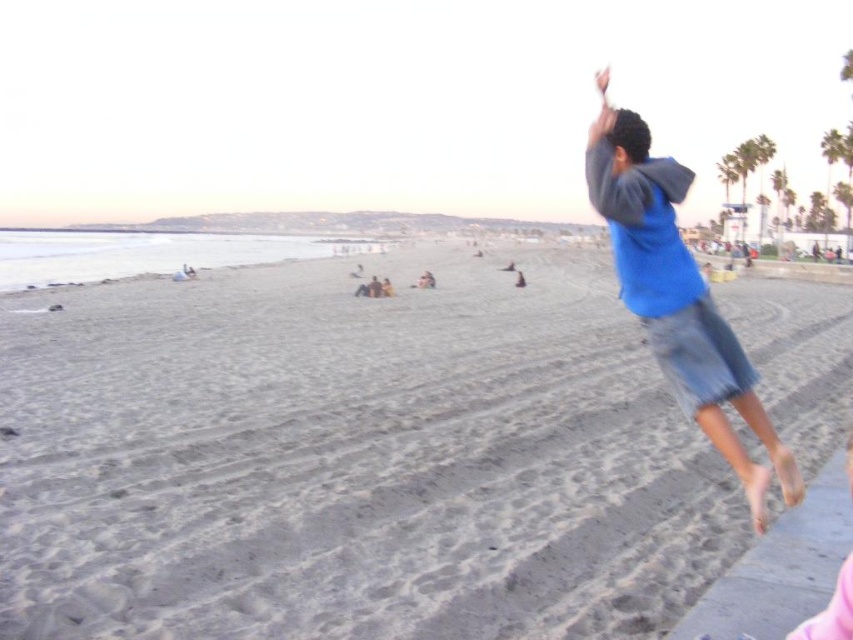
Question: Observing the image, what is the correct spatial positioning of gray sand at lower center in reference to blue cotton shirt at upper right?

Choices:
 (A) below
 (B) above

Answer: (B)

Question: Considering the relative positions of gray sand at lower center and blue cotton shirt at upper right in the image provided, where is gray sand at lower center located with respect to blue cotton shirt at upper right?

Choices:
 (A) above
 (B) below

Answer: (A)

Question: Which point is farther to the camera?

Choices:
 (A) (776, 467)
 (B) (302, 545)

Answer: (B)

Question: Is gray sand at lower center bigger than blue cotton shirt at upper right?

Choices:
 (A) no
 (B) yes

Answer: (B)